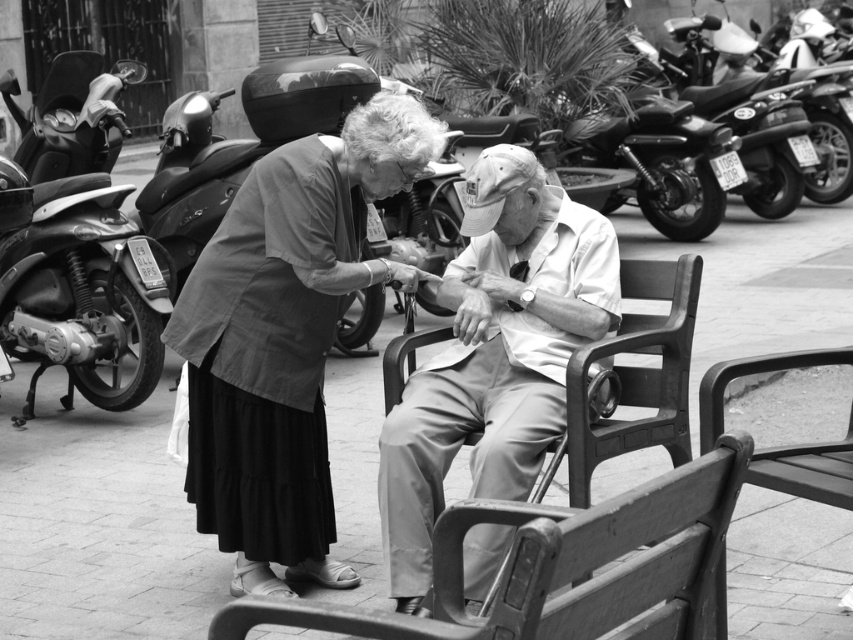
Does light brown wooden bench at center appear over metallic silver motorcycle at upper right?

Incorrect, light brown wooden bench at center is not positioned above metallic silver motorcycle at upper right.

Consider the image. Between light brown wooden bench at center and metallic silver motorcycle at upper right, which one is positioned higher?

metallic silver motorcycle at upper right

Which is in front, point (418, 376) or point (763, 148)?

Point (418, 376)

Find the location of a particular element. light brown wooden bench at center is located at coordinates (496, 352).

Measure the distance between light brown wooden bench at center and camera.

light brown wooden bench at center is 5.03 meters away from camera.

Looking at this image, which is more to the right, light brown wooden bench at center or smooth beige pants at center?

From the viewer's perspective, light brown wooden bench at center appears more on the right side.

Find the location of a particular element. The image size is (853, 640). light brown wooden bench at center is located at coordinates (496, 352).

Can you confirm if smooth beige pants at center is positioned to the left of shiny black motorcycle at left?

In fact, smooth beige pants at center is to the right of shiny black motorcycle at left.

Between point (509, 440) and point (117, 272), which one is positioned in front?

Point (509, 440) is in front.

Where is `smooth beige pants at center`? smooth beige pants at center is located at coordinates [495, 353].